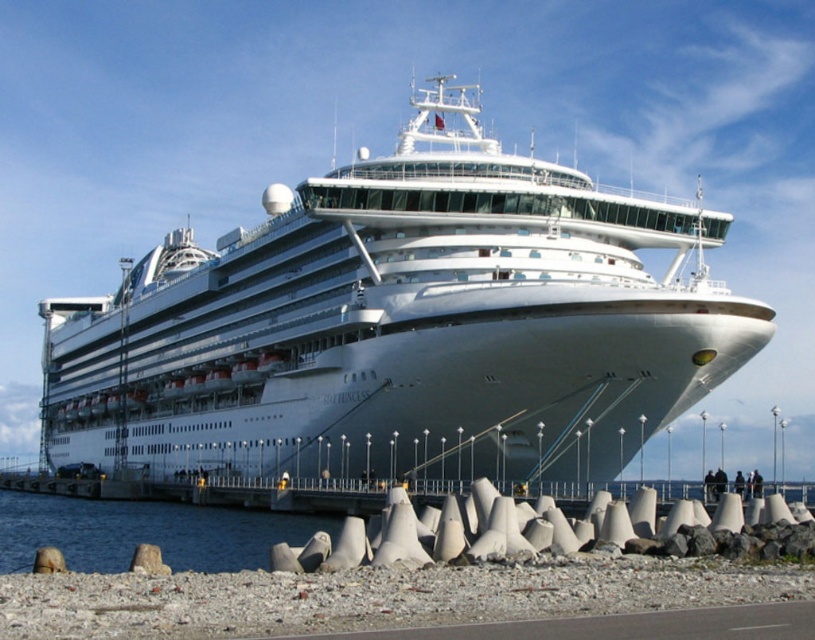
Question: Is white glossy cruise ship at center to the left of clear water at lower left from the viewer's perspective?

Choices:
 (A) no
 (B) yes

Answer: (A)

Question: Which point is closer to the camera?

Choices:
 (A) clear water at lower left
 (B) white glossy cruise ship at center

Answer: (A)

Question: Can you confirm if white glossy cruise ship at center is bigger than clear water at lower left?

Choices:
 (A) no
 (B) yes

Answer: (B)

Question: Among these points, which one is farthest from the camera?

Choices:
 (A) (554, 388)
 (B) (274, 532)

Answer: (A)

Question: Is white glossy cruise ship at center to the right of clear water at lower left from the viewer's perspective?

Choices:
 (A) no
 (B) yes

Answer: (B)